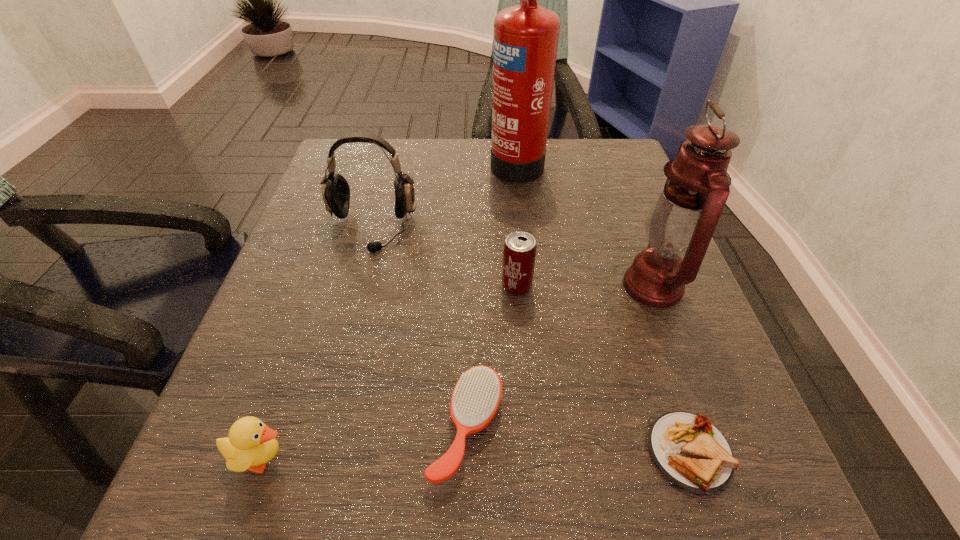
Image resolution: width=960 pixels, height=540 pixels. I want to click on vacant position located on the surface of the farthest object, so click(x=438, y=161).

Locate an element on the screen. free location located on the surface of the farthest object is located at coordinates (396, 161).

I want to click on vacant space situated on the back of the oil lamp, so click(612, 175).

You are a GUI agent. You are given a task and a screenshot of the screen. Output one action in this format:
    pyautogui.click(x=<x>, y=<y>)
    Task: Click on the free space located 0.290m with the microphone on the side of the fifth shortest object
    The width and height of the screenshot is (960, 540).
    Given the screenshot: What is the action you would take?
    pyautogui.click(x=329, y=389)

Locate an element on the screen. Image resolution: width=960 pixels, height=540 pixels. vacant space located 0.340m on the left of the beer can is located at coordinates [312, 286].

Locate an element on the screen. vacant area located on the front-facing side of the third shortest object is located at coordinates (538, 458).

Identify the location of free space located on the right of the sixth tallest object. Image resolution: width=960 pixels, height=540 pixels. (692, 428).

Find the location of a particular element. This screenshot has height=540, width=960. free space located 0.070m on the back of the sandwich is located at coordinates (662, 371).

The image size is (960, 540). I want to click on object that is at the far edge, so click(x=525, y=41).

At what (x,y) coordinates should I click in order to perform the action: click on duckling located at the near edge. Please return your answer as a coordinate pair (x, y). Image resolution: width=960 pixels, height=540 pixels. Looking at the image, I should click on (251, 444).